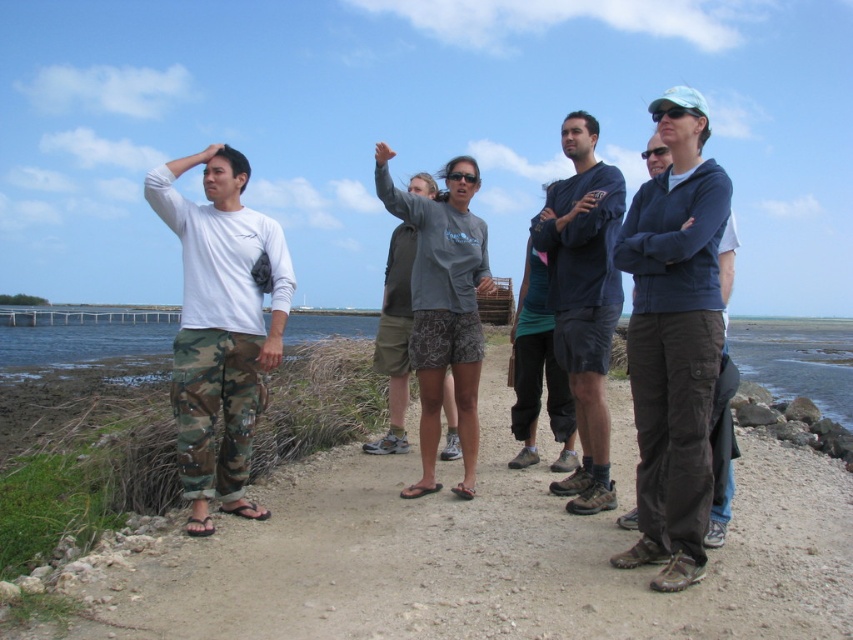
Does brown dirt path at center have a lesser width compared to gray fabric shirt at center?

Incorrect, brown dirt path at center's width is not less than gray fabric shirt at center's.

Can you confirm if brown dirt path at center is positioned above gray fabric shirt at center?

Incorrect, brown dirt path at center is not positioned above gray fabric shirt at center.

Locate an element on the screen. The height and width of the screenshot is (640, 853). brown dirt path at center is located at coordinates (477, 557).

Between dark blue fabric shirt at center and gray fabric shirt at center, which one is positioned higher?

Positioned higher is gray fabric shirt at center.

I want to click on dark blue fabric shirt at center, so click(x=583, y=300).

I want to click on dark blue fabric shirt at center, so click(583, 300).

Is gray fabric shirt at center to the left of dark brown cargo pants at center from the viewer's perspective?

Indeed, gray fabric shirt at center is positioned on the left side of dark brown cargo pants at center.

Does gray fabric shirt at center have a larger size compared to dark brown cargo pants at center?

Correct, gray fabric shirt at center is larger in size than dark brown cargo pants at center.

Is point (412, 490) positioned in front of point (653, 164)?

No, (412, 490) is behind (653, 164).

Locate an element on the screen. The width and height of the screenshot is (853, 640). gray fabric shirt at center is located at coordinates (444, 307).